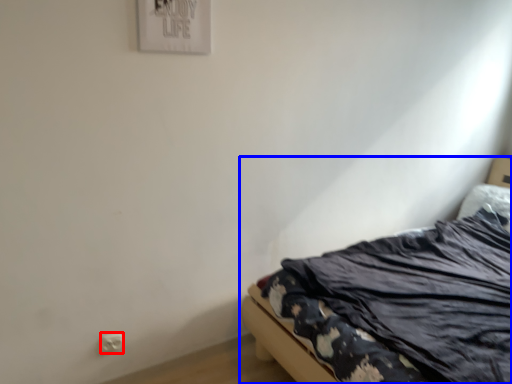
Question: Which point is closer to the camera, electric outlet (highlighted by a red box) or bed (highlighted by a blue box)?

Choices:
 (A) electric outlet
 (B) bed

Answer: (B)